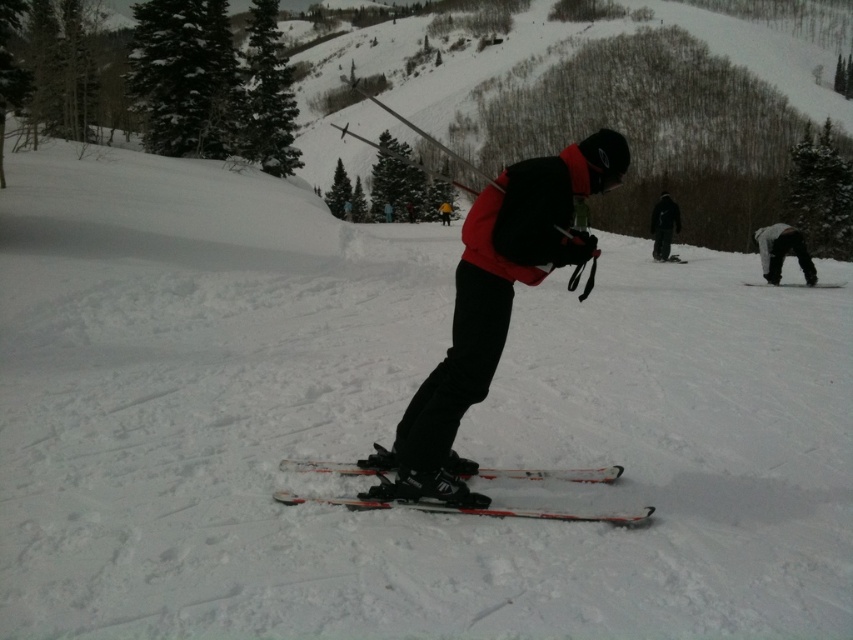
Question: Does white matte skis at center have a larger size compared to white matte ski at lower right?

Choices:
 (A) no
 (B) yes

Answer: (A)

Question: Can you confirm if matte black ski suit at center is positioned below gray fabric pants at lower right?

Choices:
 (A) yes
 (B) no

Answer: (A)

Question: Estimate the real-world distances between objects in this image. Which object is closer to the white matte ski at lower right?

Choices:
 (A) matte black ski suit at center
 (B) dark gray snowboard at center
 (C) white matte ski at center
 (D) gray fabric pants at lower right

Answer: (D)

Question: Which point is closer to the camera taking this photo?

Choices:
 (A) (757, 284)
 (B) (335, 472)
 (C) (759, 262)
 (D) (550, 182)

Answer: (D)

Question: Which point is closer to the camera taking this photo?

Choices:
 (A) (497, 513)
 (B) (670, 216)
 (C) (834, 288)
 (D) (538, 170)

Answer: (D)

Question: Is matte black ski suit at center closer to the viewer compared to dark gray snowboard at center?

Choices:
 (A) no
 (B) yes

Answer: (B)